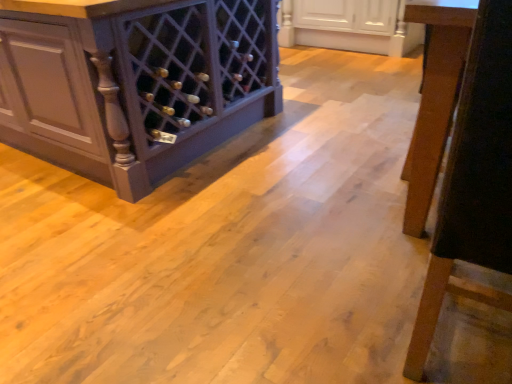
What are the coordinates of `free space that is in between wooden chair leg at right and matte dark wood wine rack at left, the 1th cabinetry from the left` in the screenshot? It's located at (252, 214).